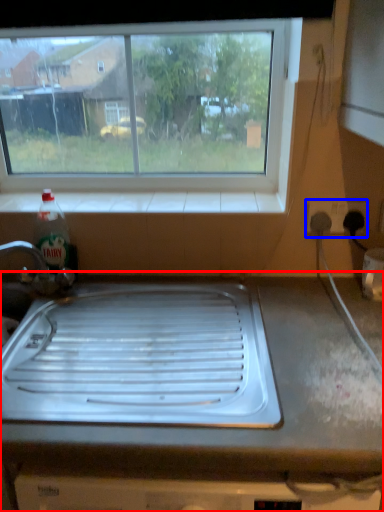
Question: Which object is further to the camera taking this photo, countertop (highlighted by a red box) or electric outlet (highlighted by a blue box)?

Choices:
 (A) countertop
 (B) electric outlet

Answer: (B)